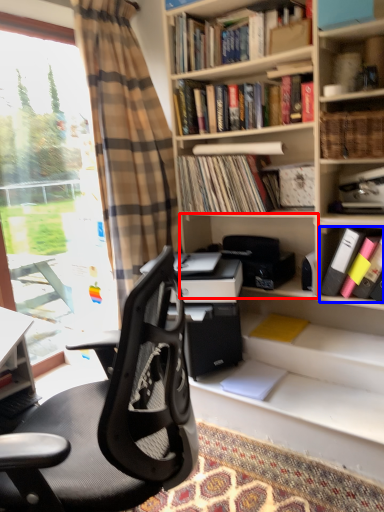
Question: Among these objects, which one is farthest to the camera, shelf (highlighted by a red box) or book (highlighted by a blue box)?

Choices:
 (A) shelf
 (B) book

Answer: (A)